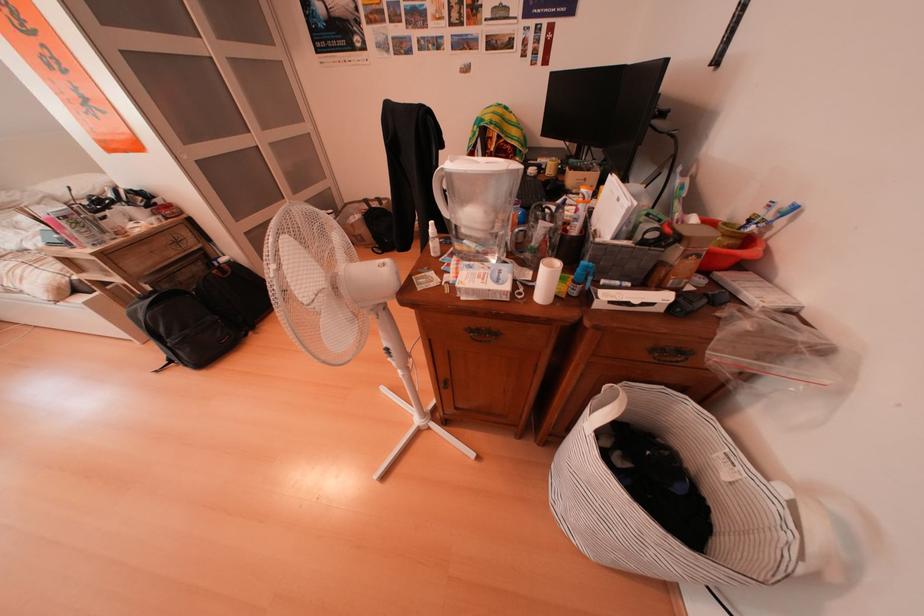
The width and height of the screenshot is (924, 616). I want to click on white pitcher handle, so click(x=477, y=204).